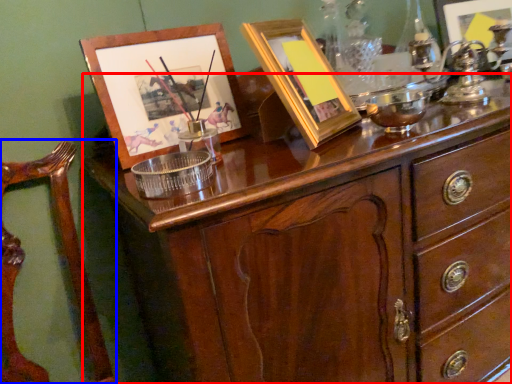
Question: Among these objects, which one is nearest to the camera, chest of drawers (highlighted by a red box) or armchair (highlighted by a blue box)?

Choices:
 (A) chest of drawers
 (B) armchair

Answer: (B)